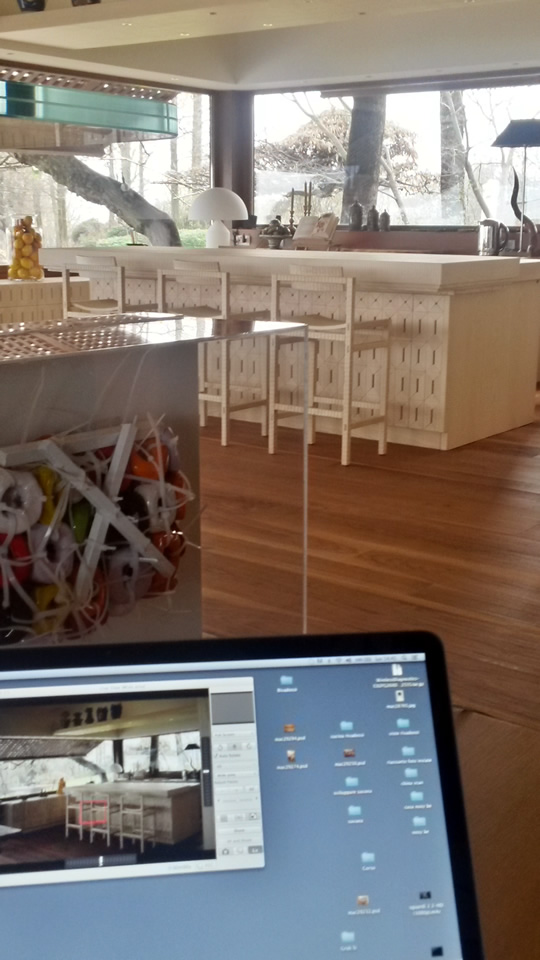
Locate an element on the screen. The height and width of the screenshot is (960, 540). light on top of the table is located at coordinates (225, 203).